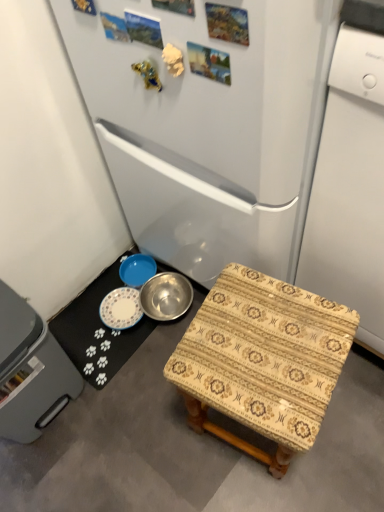
The image size is (384, 512). What are the coordinates of `free location to the left of patterned fabric stool at lower right` in the screenshot? It's located at (158, 434).